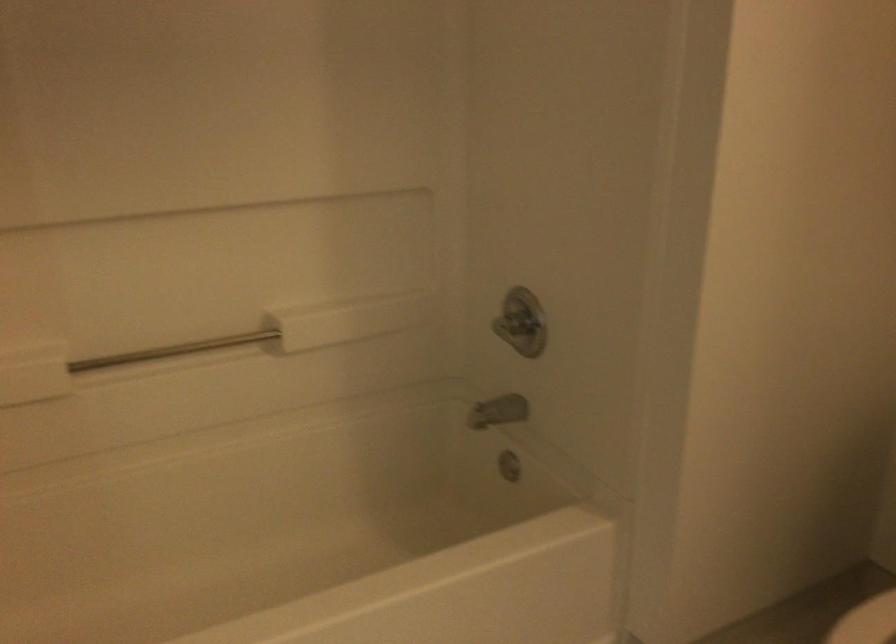
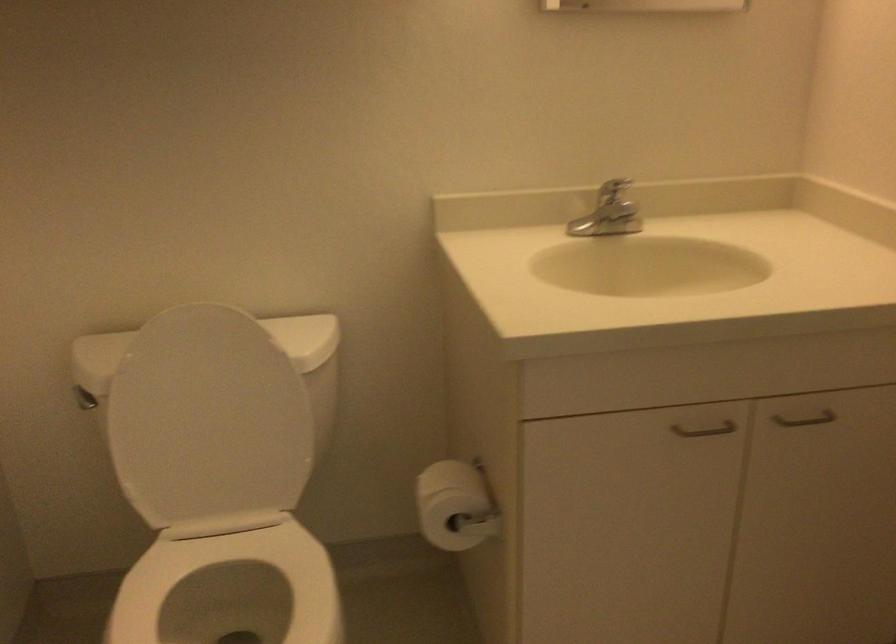
Question: The camera is either moving clockwise (left) or counter-clockwise (right) around the object. The first image is from the beginning of the video and the second image is from the end. Is the camera moving left or right when shooting the video?

Choices:
 (A) Left
 (B) Right

Answer: (A)